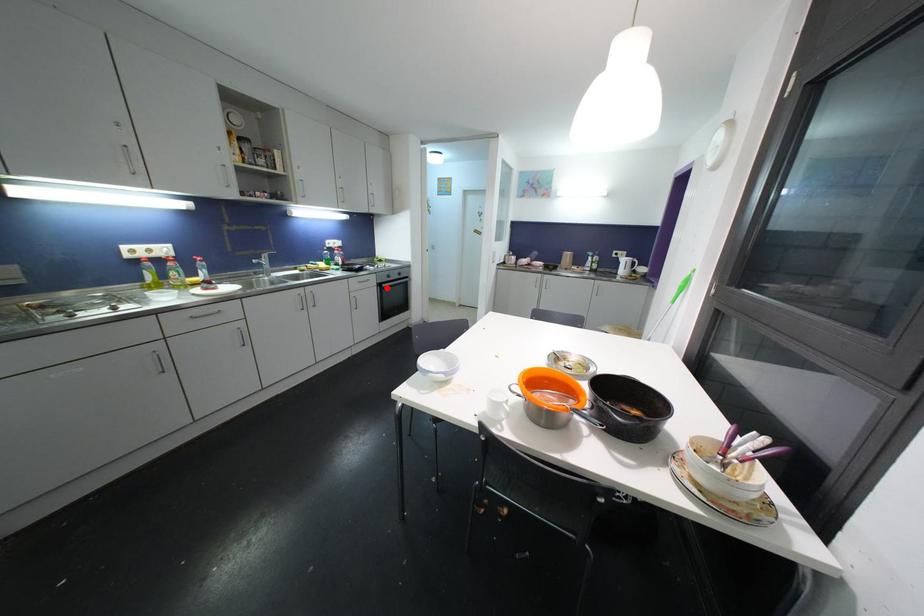
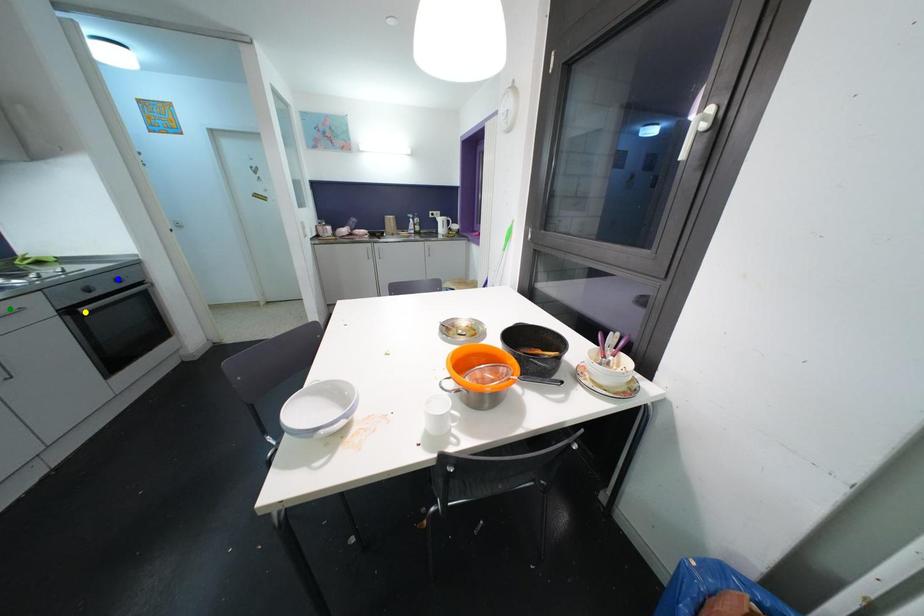
Question: I am providing you with two images of the same scene from different viewpoints. A red point is marked on the first image. You are given multiple points on the second image. Which point in image 2 is actually the same real-world point as the red point in image 1?

Choices:
 (A) green point
 (B) blue point
 (C) yellow point

Answer: (C)